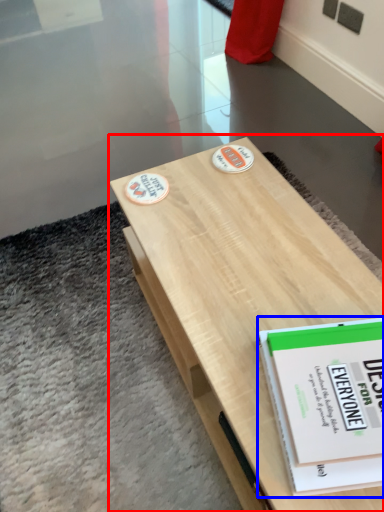
Question: Which of the following is the farthest to the observer, table (highlighted by a red box) or book (highlighted by a blue box)?

Choices:
 (A) table
 (B) book

Answer: (B)